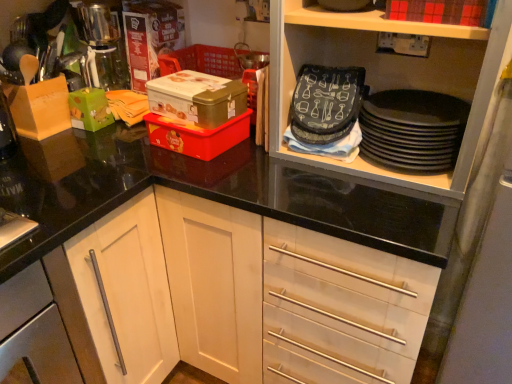
Identify the location of vacant space in front of black matte plates at upper right. (389, 212).